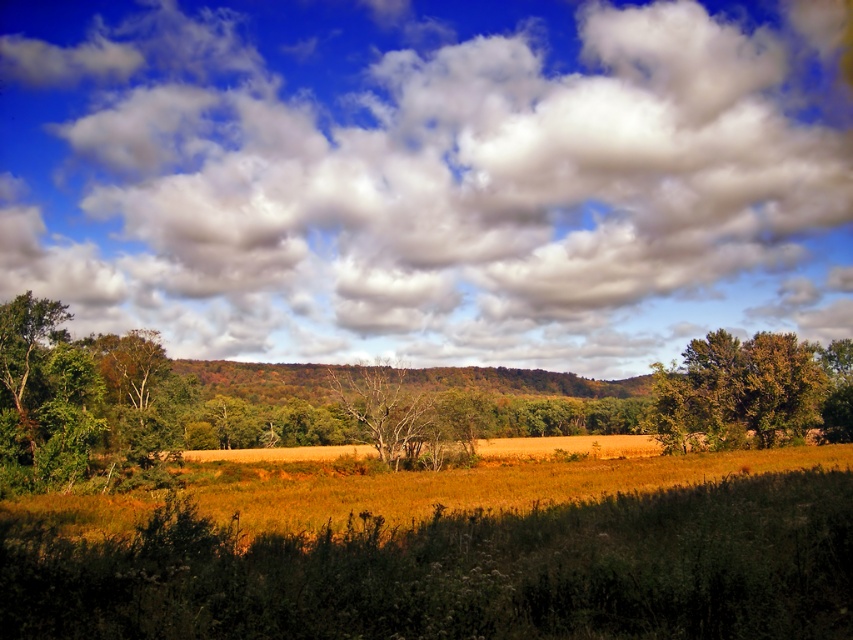
You are standing in the field of golden crops and see the white fluffy cloud at upper center and the bare wood tree at center. Which object is closer to you?

The bare wood tree at center is closer to you than the white fluffy cloud at upper center because the distance between them is 234.81 feet, so the tree is nearer.

You are an astronomer analyzing the image. You need to determine the position of the white fluffy cloud at upper center. What are its coordinates?

The white fluffy cloud at upper center is located at coordinates [428,176].